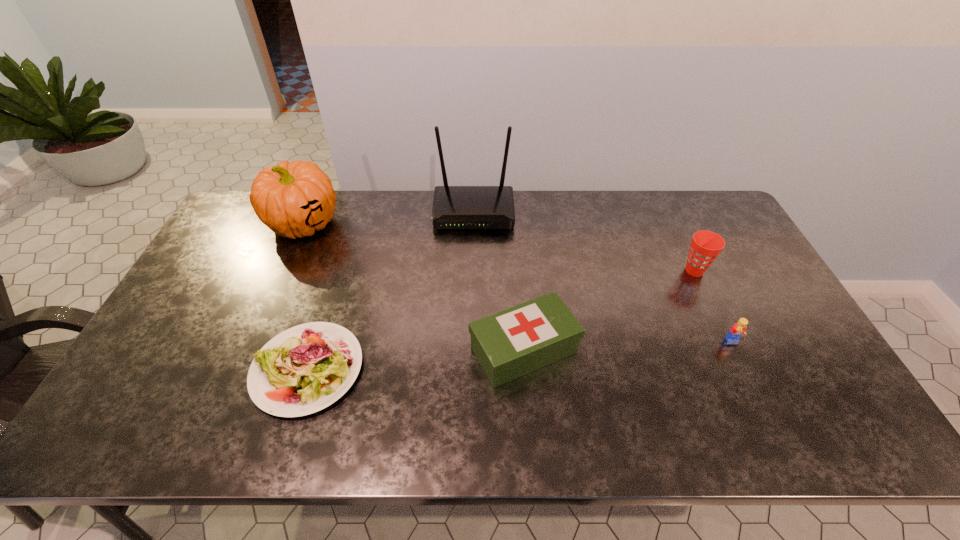
The width and height of the screenshot is (960, 540). Find the location of `vacant region that satisfies the following two spatial constraints: 1. on the back side of the cup; 2. on the right side of the first-aid kit`. vacant region that satisfies the following two spatial constraints: 1. on the back side of the cup; 2. on the right side of the first-aid kit is located at coordinates (517, 271).